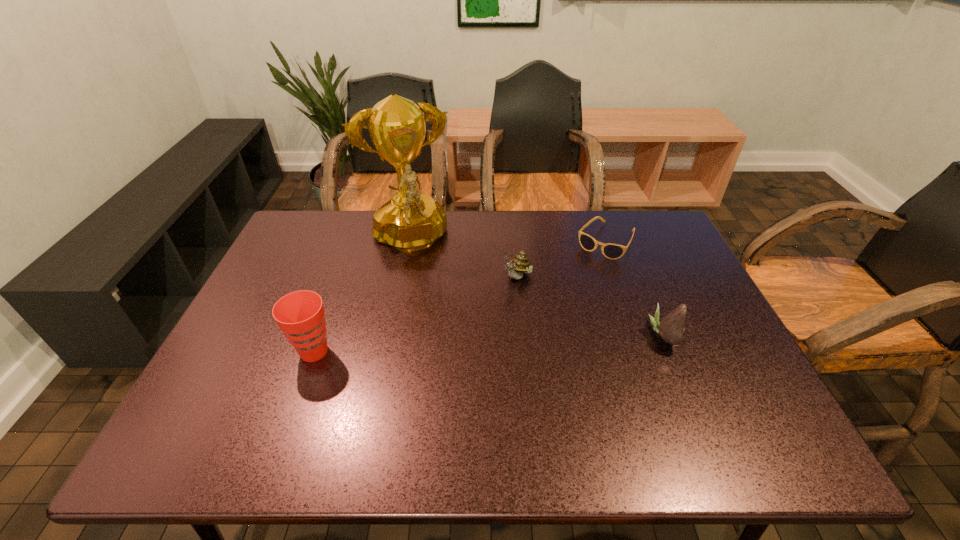
Locate an element on the screen. free point between the avocado and the third object from right to left is located at coordinates (590, 307).

The width and height of the screenshot is (960, 540). Find the location of `free space between the cup and the avocado`. free space between the cup and the avocado is located at coordinates (489, 343).

I want to click on free space that is in between the avocado and the sunglasses, so click(x=635, y=288).

Where is `vacant area that lies between the fourth shortest object and the tallest object`? The width and height of the screenshot is (960, 540). vacant area that lies between the fourth shortest object and the tallest object is located at coordinates (362, 296).

At what (x,y) coordinates should I click in order to perform the action: click on vacant area between the second tallest object and the avocado. Please return your answer as a coordinate pair (x, y). This screenshot has height=540, width=960. Looking at the image, I should click on (489, 343).

Find the location of a particular element. The width and height of the screenshot is (960, 540). empty location between the tallest object and the shortest object is located at coordinates (508, 241).

Find the location of a particular element. The width and height of the screenshot is (960, 540). vacant space that's between the sunglasses and the avocado is located at coordinates (635, 288).

Choose which object is the third nearest neighbor to the third object from left to right. Please provide its 2D coordinates. Your answer should be formatted as a tuple, i.e. [(x, y)], where the tuple contains the x and y coordinates of a point satisfying the conditions above.

[(671, 328)]

Identify the location of the third closest object relative to the second tallest object. This screenshot has width=960, height=540. (611, 251).

Locate an element on the screen. The width and height of the screenshot is (960, 540). vacant space that satisfies the following two spatial constraints: 1. on the back side of the fourth shortest object; 2. on the seed side of the avocado is located at coordinates (320, 335).